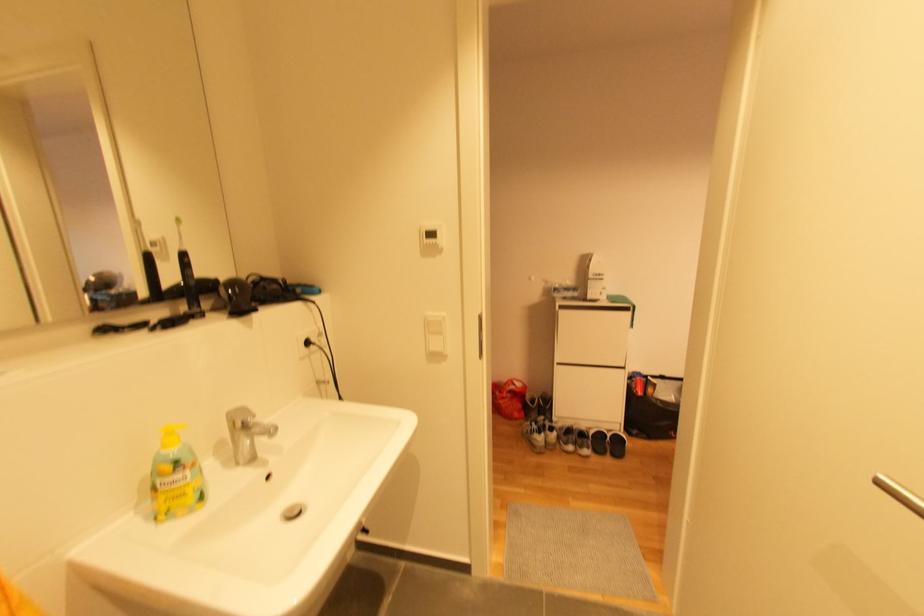
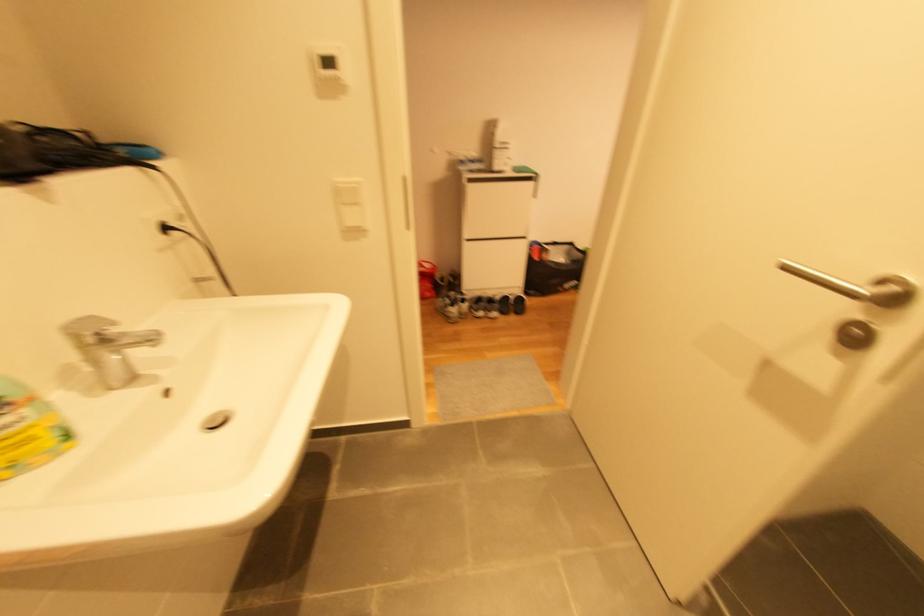
From the picture: How did the camera likely rotate?

The camera's rotation is toward right-down.